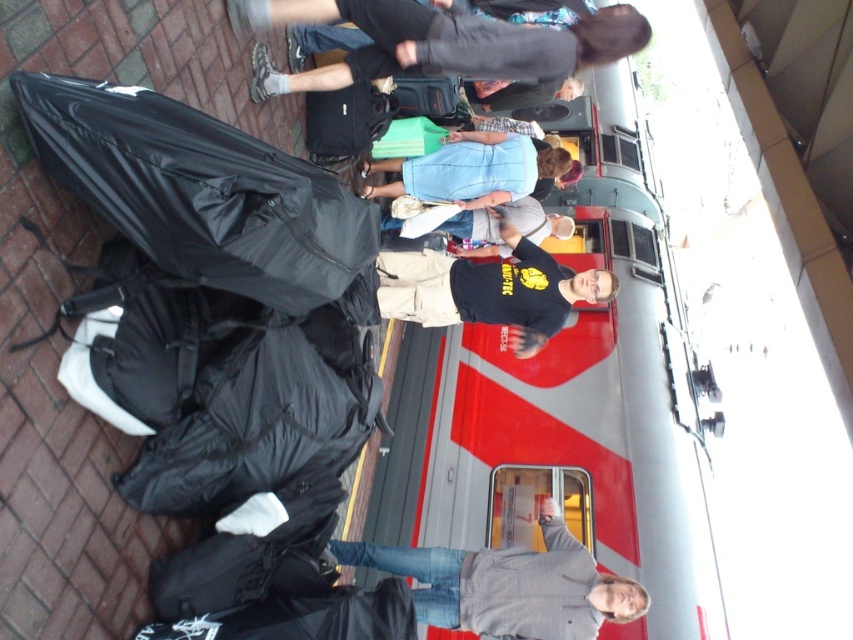
Question: Which point is closer to the camera?

Choices:
 (A) dark gray pants at center
 (B) blue cotton shirt at center
 (C) gray cotton hoodie at center
 (D) matte black jacket at center

Answer: (A)

Question: Does matte black bag at center appear on the right side of black t-shirt at center?

Choices:
 (A) yes
 (B) no

Answer: (B)

Question: Among these points, which one is nearest to the camera?

Choices:
 (A) (341, 132)
 (B) (514, 65)
 (C) (436, 141)

Answer: (B)

Question: Which point is closer to the camera?

Choices:
 (A) (519, 556)
 (B) (540, 212)
 (C) (387, 312)
 (D) (521, 97)

Answer: (A)

Question: Does matte black bag at center have a greater width compared to green fabric bag at center?

Choices:
 (A) yes
 (B) no

Answer: (B)

Question: Does dark gray pants at center come in front of blue cotton shirt at center?

Choices:
 (A) no
 (B) yes

Answer: (B)